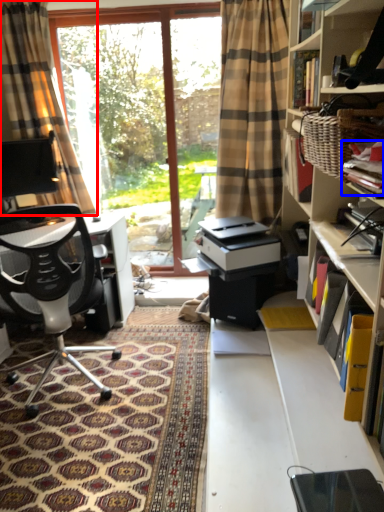
Question: Which object is further to the camera taking this photo, curtain (highlighted by a red box) or book (highlighted by a blue box)?

Choices:
 (A) curtain
 (B) book

Answer: (A)